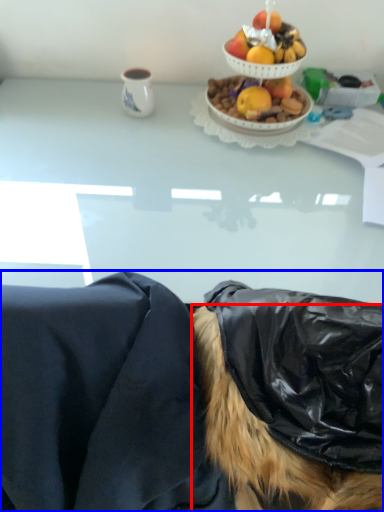
Question: Among these objects, which one is nearest to the camera, wig (highlighted by a red box) or person (highlighted by a blue box)?

Choices:
 (A) wig
 (B) person

Answer: (A)